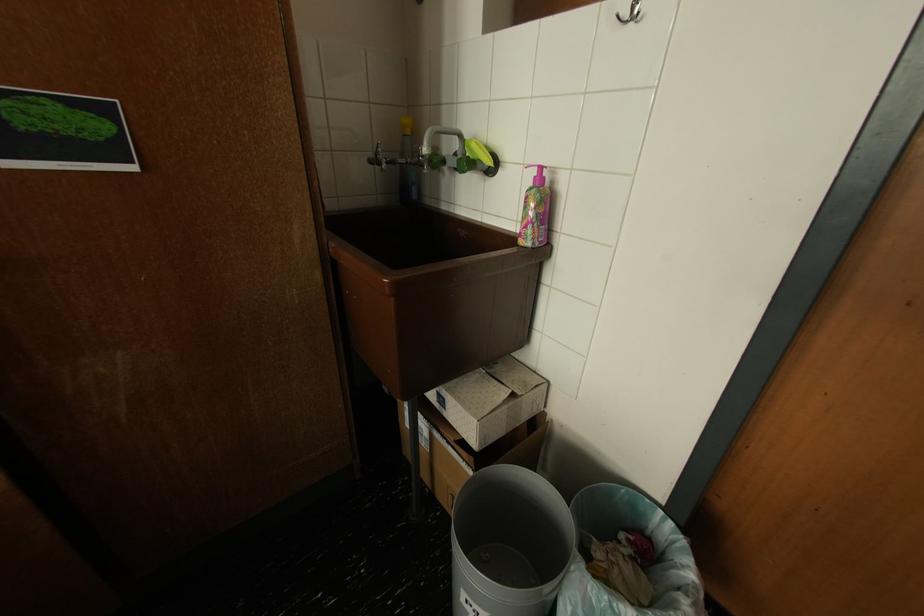
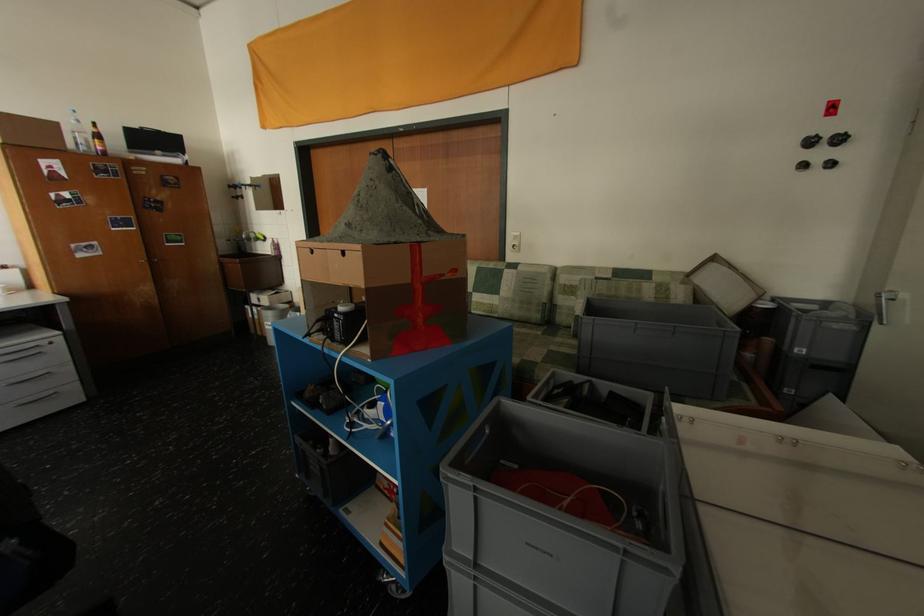
Question: In a continuous first-person perspective shot, in which direction is the camera moving?

Choices:
 (A) Left
 (B) Right
 (C) Forward
 (D) Backward

Answer: (D)